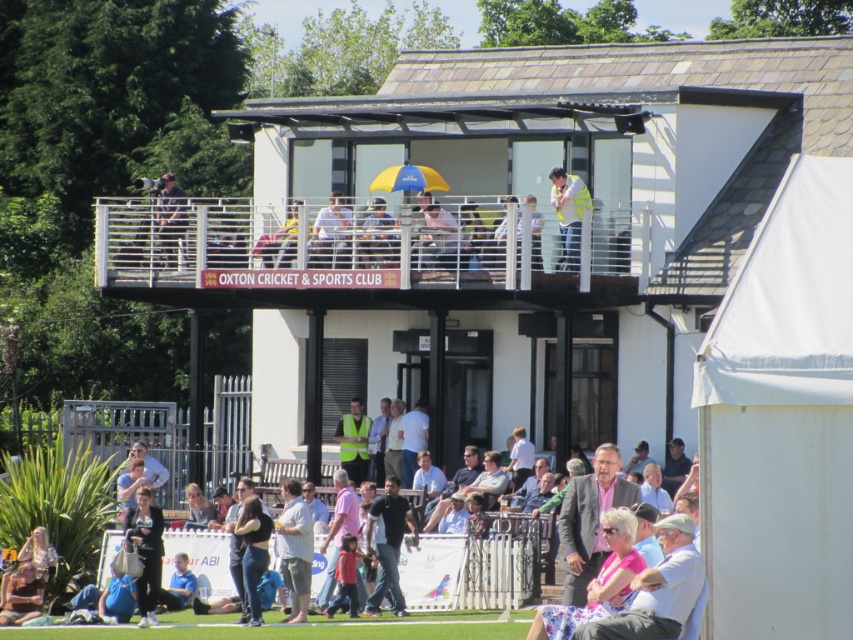
Question: Which point is farther to the camera?

Choices:
 (A) (358, 298)
 (B) (398, 512)

Answer: (A)

Question: Is black cotton shirt at center bigger than reflective silver camera at upper center?

Choices:
 (A) yes
 (B) no

Answer: (A)

Question: Is black cotton shirt at center closer to the viewer compared to reflective silver camera at upper center?

Choices:
 (A) no
 (B) yes

Answer: (B)

Question: Which point is farther to the camera?

Choices:
 (A) reflective silver camera at upper center
 (B) light blue shirt at lower center

Answer: (A)

Question: Can you confirm if light blue shirt at lower center is thinner than reflective yellow vest at center?

Choices:
 (A) no
 (B) yes

Answer: (A)

Question: Which of the following is the closest to the observer?

Choices:
 (A) light blue shirt at lower center
 (B) yellow fabric umbrella at upper center
 (C) reflective yellow vest at center

Answer: (A)